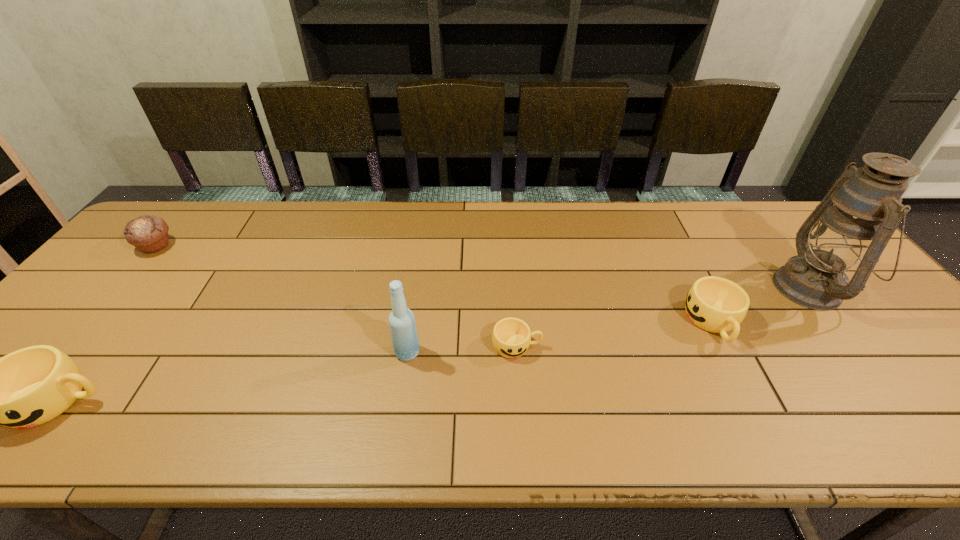
In the image, there is a desktop. Where is `free space at the right edge`? free space at the right edge is located at coordinates (833, 318).

Identify the location of vacant area between the fifth object from left to right and the oil lamp. (761, 305).

What are the coordinates of `empty location between the third object from left to right and the second object from right to left` in the screenshot? It's located at (561, 338).

What are the coordinates of `empty space that is in between the fifth shortest object and the second object from right to left` in the screenshot? It's located at (561, 338).

Locate an element on the screen. The width and height of the screenshot is (960, 540). free space between the muffin and the rightmost cup is located at coordinates (434, 285).

Identify the location of unoccupied area between the shortest cup and the rightmost object. The image size is (960, 540). (663, 317).

You are a GUI agent. You are given a task and a screenshot of the screen. Output one action in this format:
    pyautogui.click(x=<x>, y=<y>)
    Task: Click on the unoccupied position between the third object from right to left and the oil lamp
    The width and height of the screenshot is (960, 540).
    Given the screenshot: What is the action you would take?
    pyautogui.click(x=663, y=317)

You are a GUI agent. You are given a task and a screenshot of the screen. Output one action in this format:
    pyautogui.click(x=<x>, y=<y>)
    Task: Click on the object that is the second closest to the muffin
    This screenshot has width=960, height=540.
    Given the screenshot: What is the action you would take?
    pyautogui.click(x=404, y=336)

Identify which object is the fourth closest to the second tallest object. Please provide its 2D coordinates. Your answer should be formatted as a tuple, i.e. [(x, y)], where the tuple contains the x and y coordinates of a point satisfying the conditions above.

[(148, 233)]

Find the location of a particular element. This screenshot has width=960, height=540. cup that stands as the closest to the muffin is located at coordinates (31, 386).